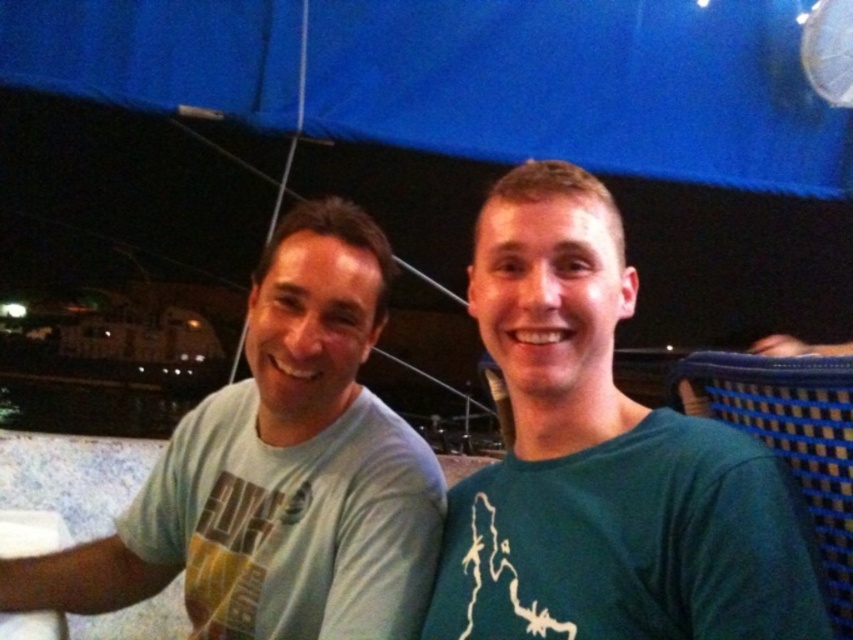
Question: Is green matte shirt at right below light blue cotton shirt at left?

Choices:
 (A) no
 (B) yes

Answer: (A)

Question: Which is nearer to the green matte shirt at right?

Choices:
 (A) light blue cotton shirt at center
 (B) light blue cotton shirt at left

Answer: (A)

Question: Which object appears closest to the camera in this image?

Choices:
 (A) light blue cotton shirt at left
 (B) light blue cotton shirt at center

Answer: (B)

Question: Is light blue cotton shirt at center above light blue cotton shirt at left?

Choices:
 (A) yes
 (B) no

Answer: (A)

Question: Does light blue cotton shirt at center come in front of light blue cotton shirt at left?

Choices:
 (A) no
 (B) yes

Answer: (B)

Question: Which point is closer to the camera taking this photo?

Choices:
 (A) coord(321,442)
 (B) coord(564,584)
 (C) coord(537,576)

Answer: (B)